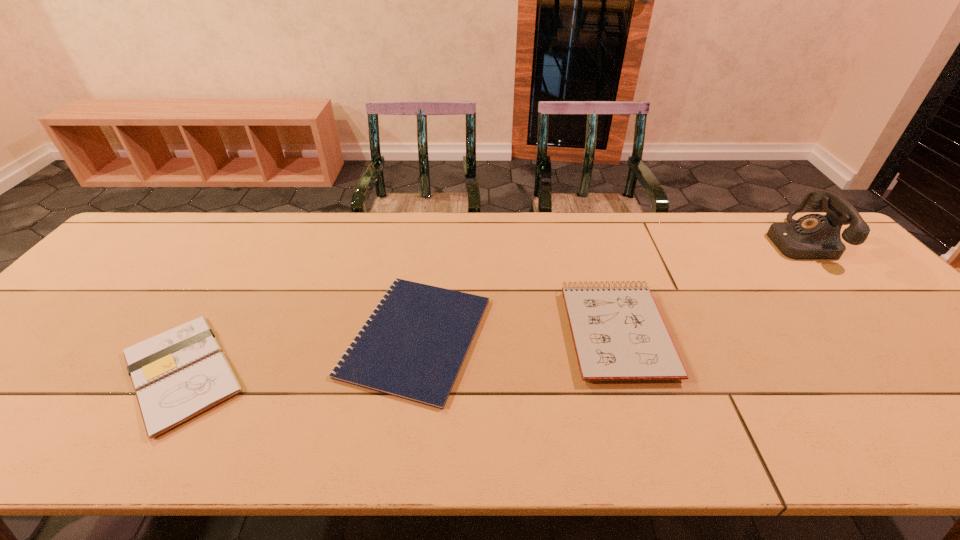
Image resolution: width=960 pixels, height=540 pixels. I want to click on telephone, so click(814, 236).

Identify the location of the farthest object. The width and height of the screenshot is (960, 540). (814, 236).

The height and width of the screenshot is (540, 960). Identify the location of the second tallest object. (618, 333).

What are the coordinates of `the tallest notepad` in the screenshot? It's located at (618, 333).

The image size is (960, 540). Find the location of `the leftmost object`. the leftmost object is located at coordinates (178, 374).

What are the coordinates of `the third object from right to left` in the screenshot? It's located at (412, 346).

Locate an element on the screen. Image resolution: width=960 pixels, height=540 pixels. the shortest notepad is located at coordinates (412, 346).

At what (x,y) coordinates should I click in order to perform the action: click on vacant space located on the dial of the tallest object. Please return your answer as a coordinate pair (x, y). Looking at the image, I should click on (707, 241).

This screenshot has width=960, height=540. Identify the location of blank space located on the dial of the tallest object. (696, 241).

This screenshot has height=540, width=960. Find the location of `vacant space located on the dial of the tallest object`. vacant space located on the dial of the tallest object is located at coordinates (684, 241).